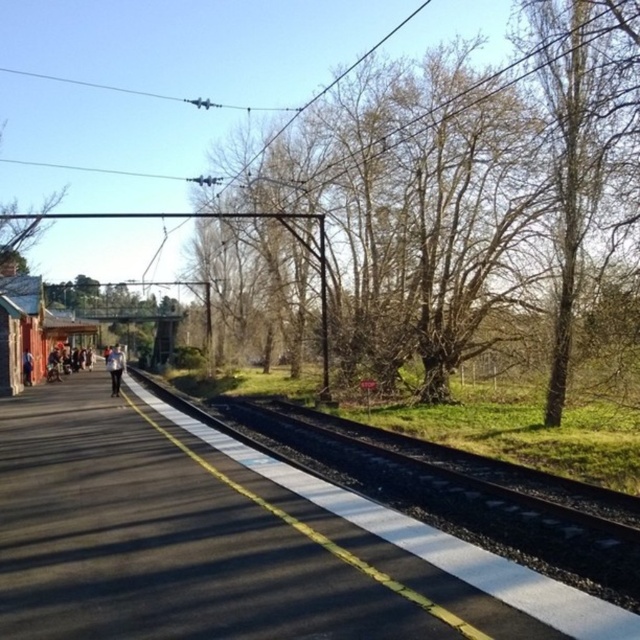
Question: Does black asphalt train track at center appear under light blue denim jacket at center?

Choices:
 (A) yes
 (B) no

Answer: (A)

Question: Which object is closer to the camera taking this photo?

Choices:
 (A) light blue denim pants at left
 (B) light blue denim jacket at center

Answer: (B)

Question: Based on their relative distances, which object is farther from the bare branches at center?

Choices:
 (A) light blue denim pants at left
 (B) black asphalt train track at center

Answer: (A)

Question: Which object is positioned closest to the light blue denim pants at left?

Choices:
 (A) black asphalt train track at center
 (B) bare branches at center
 (C) light blue denim jacket at center

Answer: (C)

Question: Is the position of bare branches at center more distant than that of light blue denim pants at left?

Choices:
 (A) yes
 (B) no

Answer: (B)

Question: Does black asphalt train track at center have a larger size compared to light blue denim pants at left?

Choices:
 (A) yes
 (B) no

Answer: (A)